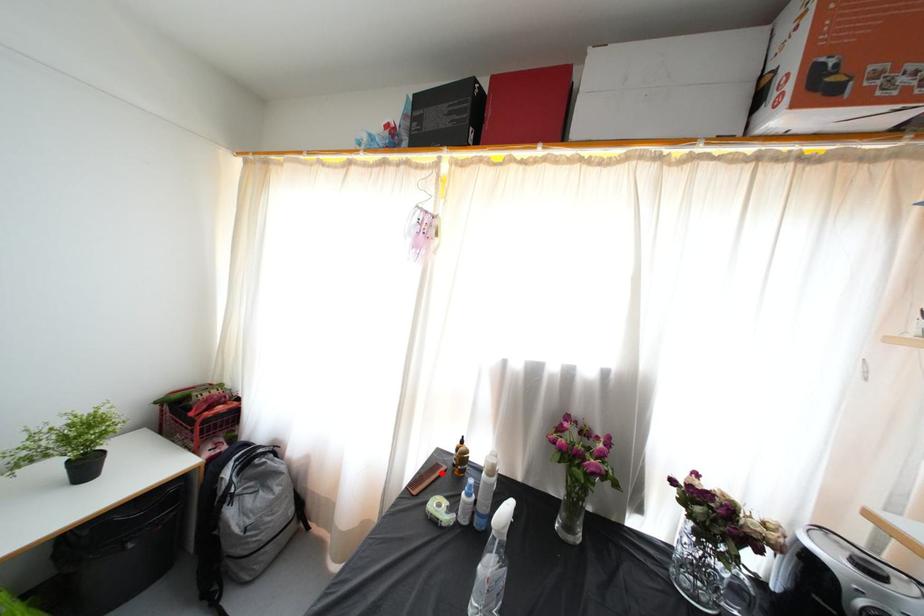
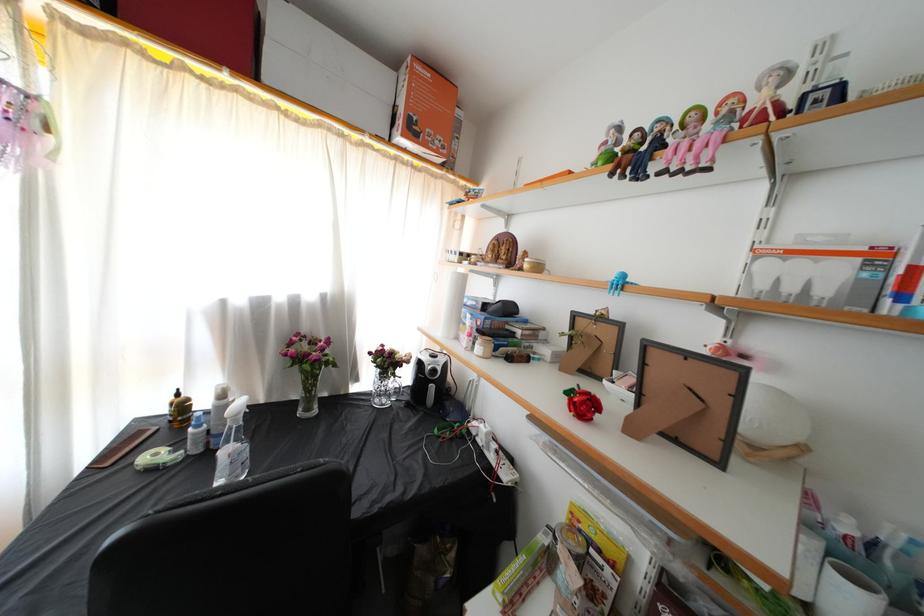
The point at the highlighted location is marked in the first image. Where is the corresponding point in the second image?

(144, 439)